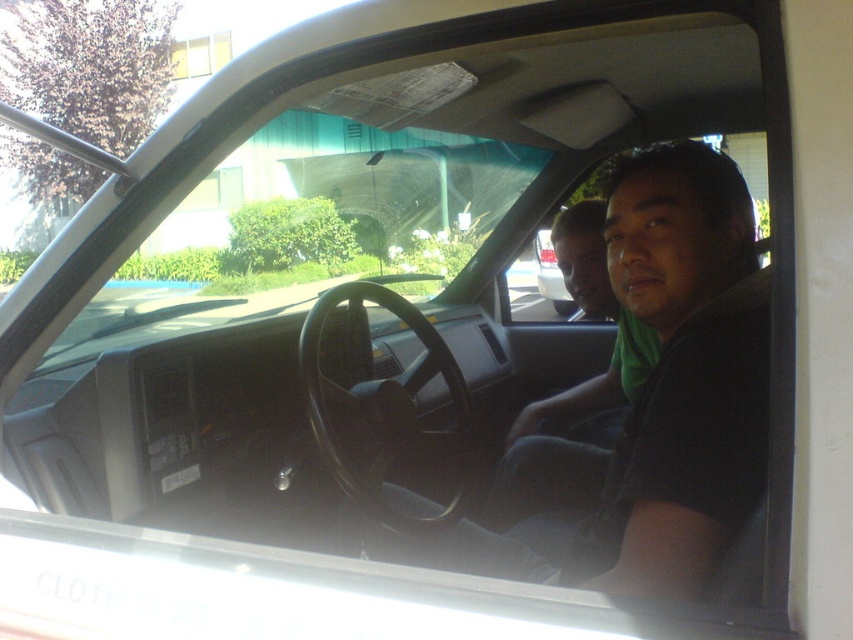
Between point (654, 376) and point (566, 259), which one is positioned behind?

The point (566, 259) is more distant.

Is black matte shirt at center wider than matte black shirt at center?

Indeed, black matte shirt at center has a greater width compared to matte black shirt at center.

The image size is (853, 640). In order to click on black matte shirt at center in this screenshot , I will do `click(653, 403)`.

Locate an element on the screen. The height and width of the screenshot is (640, 853). black matte shirt at center is located at coordinates (653, 403).